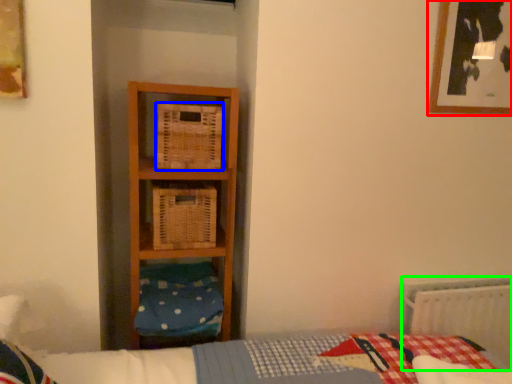
Question: Which object is positioned farthest from picture frame (highlighted by a red box)? Select from crate (highlighted by a blue box) and radiator (highlighted by a green box).

Choices:
 (A) crate
 (B) radiator

Answer: (A)